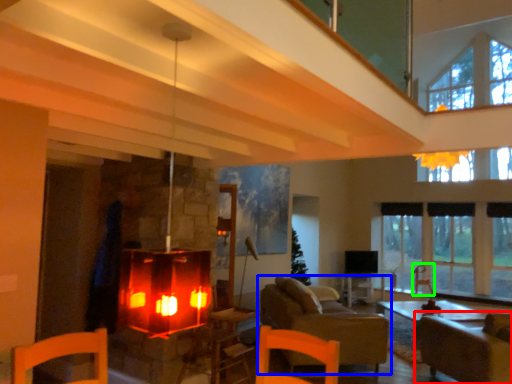
Question: Considering the real-world distances, which object is closest to armchair (highlighted by a red box)? studio couch (highlighted by a blue box) or armchair (highlighted by a green box).

Choices:
 (A) studio couch
 (B) armchair

Answer: (A)